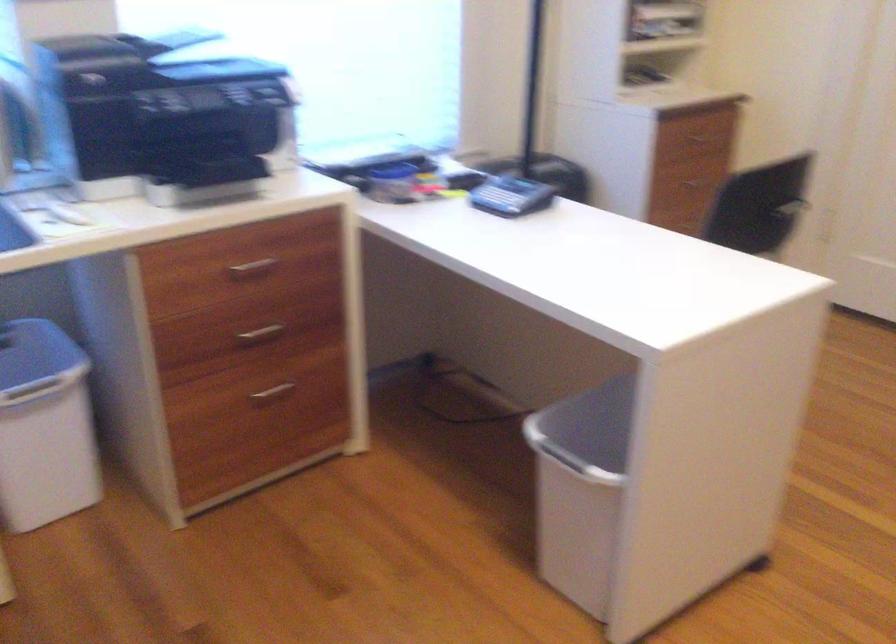
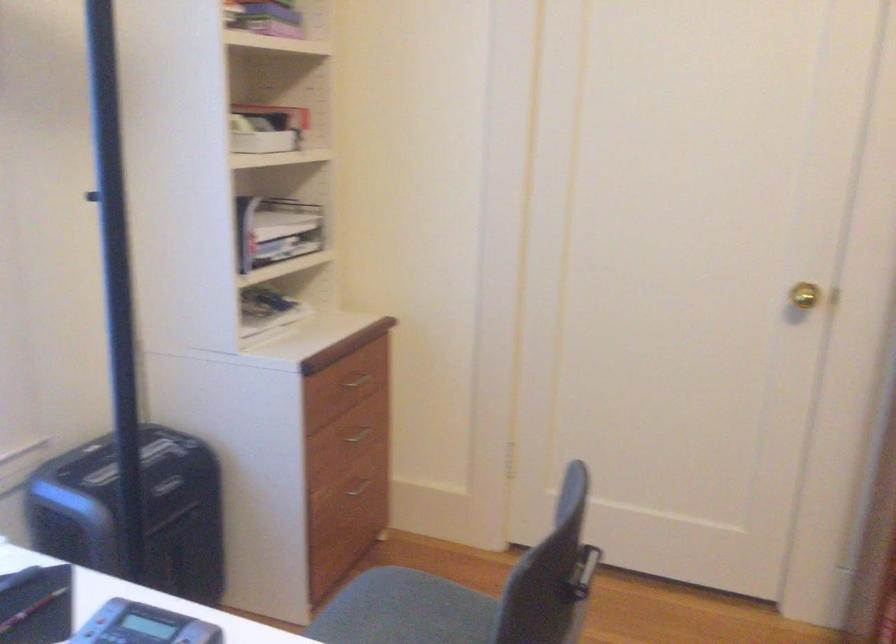
Locate, in the second image, the point that corresponds to pixel 682 182 in the first image.

(357, 431)